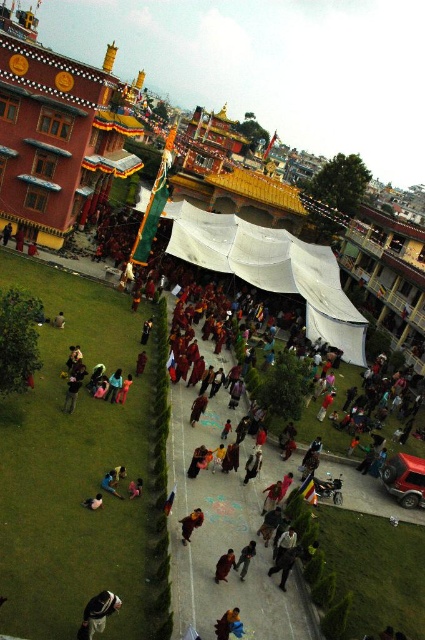
In the scene shown: You are standing in the courtyard and see a dark brown monk at center and a dark brown leather jacket at center. Which one is positioned more to the left side?

The dark brown monk at center is positioned to the left of the dark brown leather jacket at center, so the dark brown monk at center is more to the left.

You are an event organizer planning to set up a photo booth in the courtyard. You have a white fabric canopy at center and a dark brown leather jacket at center in the scene. Which object has a greater width that can accommodate more guests under it?

The white fabric canopy at center has a greater width than the dark brown leather jacket at center, so it can accommodate more guests under it.

You are standing in the courtyard and want to reach the point marked at coordinates point (232, 560). Given that the courtyard is 100 feet long, can you determine if you can reach that point without exceeding the courtyard boundaries?

The point (232, 560) is 89.58 feet from the viewer. Since the courtyard is 100 feet long, you can reach the point without exceeding the courtyard boundaries as it is within the 100 feet length.